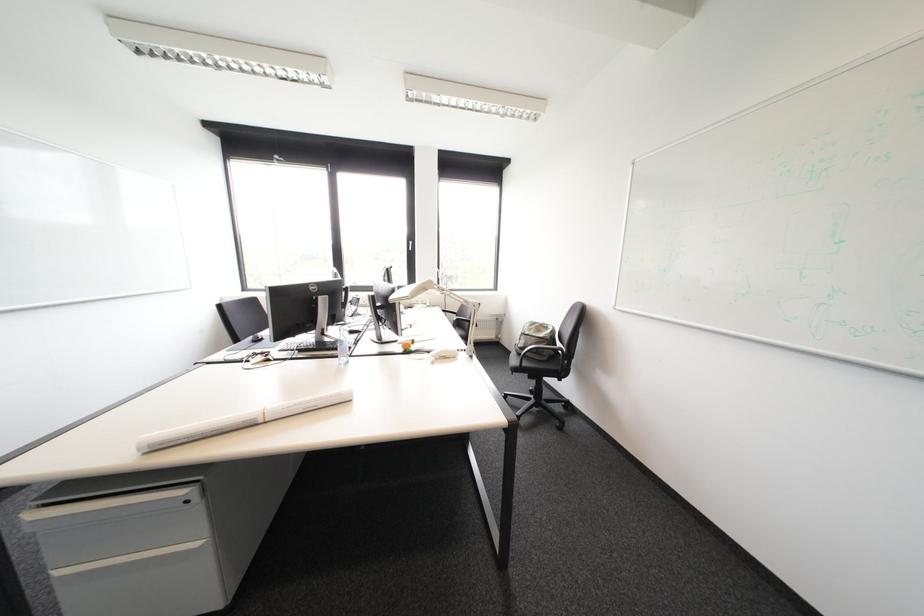
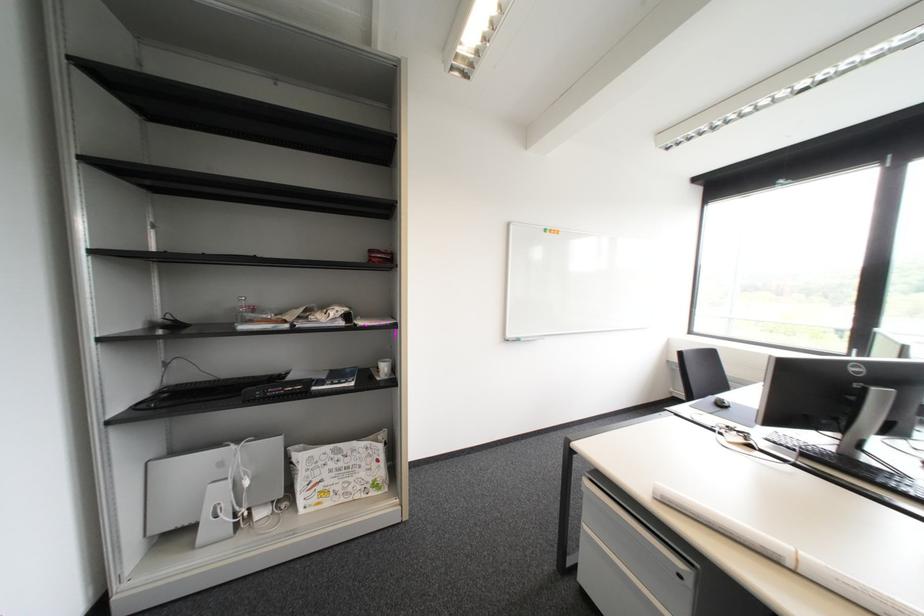
The point at (261, 339) is marked in the first image. Where is the corresponding point in the second image?

(722, 400)